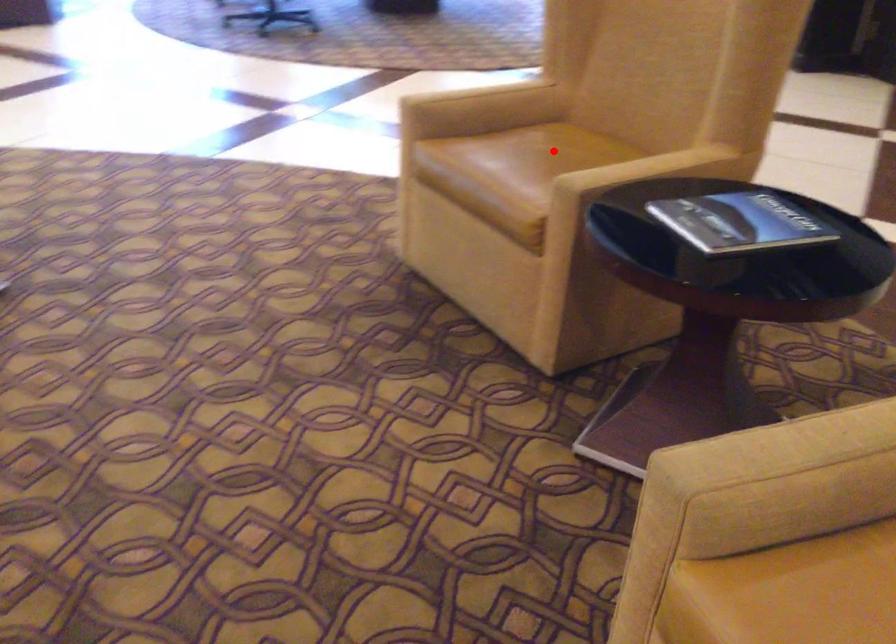
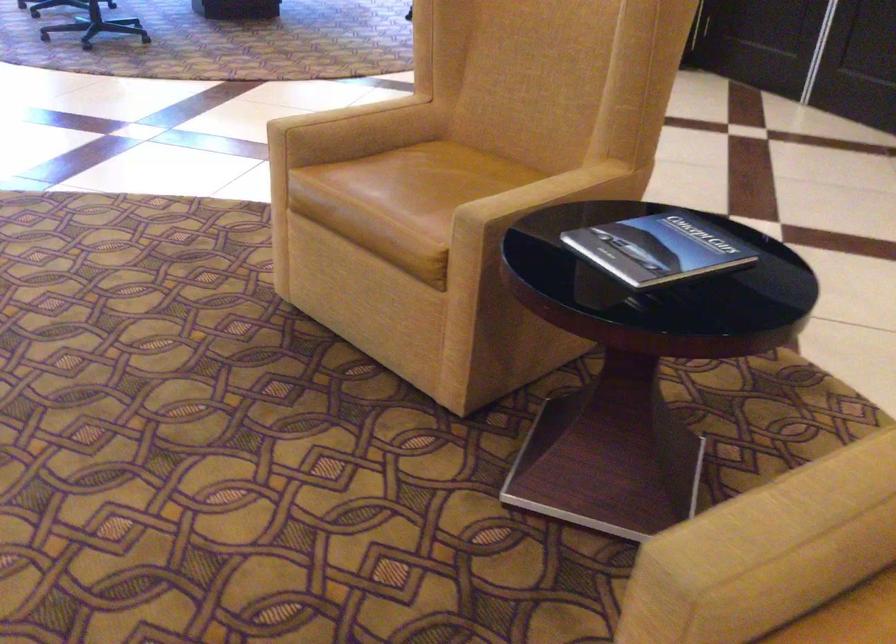
Locate, in the second image, the point that corresponds to the highlighted location in the first image.

(440, 174)